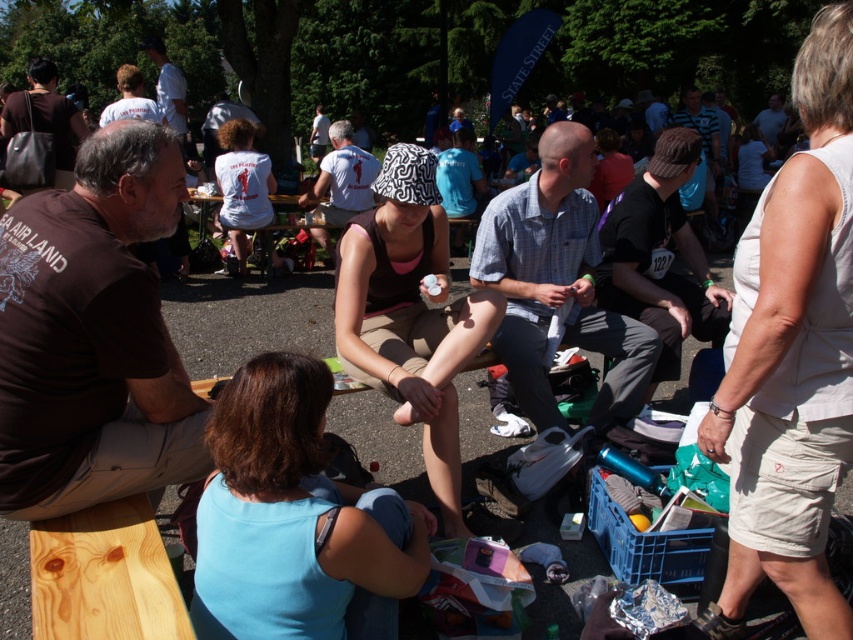
You are a photographer at the event and want to capture both the light blue plaid shirt at center and the black cotton shirt at center in the same photo. Which shirt should you focus on first to ensure both are in frame?

The light blue plaid shirt at center is positioned under the black cotton shirt at center, so focusing on the black cotton shirt at center first will allow both shirts to be captured in the photo.